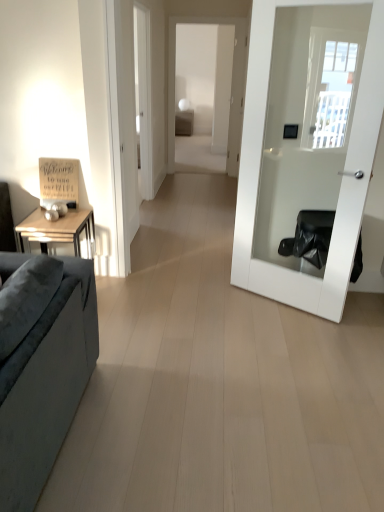
Question: Is white glossy door at right aimed at matte brown table at center?

Choices:
 (A) no
 (B) yes

Answer: (A)

Question: Is white glossy door at right not within matte brown table at center?

Choices:
 (A) no
 (B) yes

Answer: (B)

Question: From a real-world perspective, does white glossy door at right stand above matte brown table at center?

Choices:
 (A) no
 (B) yes

Answer: (B)

Question: Does white glossy door at right come in front of matte brown table at center?

Choices:
 (A) yes
 (B) no

Answer: (A)

Question: Is white glossy door at right facing away from matte brown table at center?

Choices:
 (A) yes
 (B) no

Answer: (B)

Question: Relative to matte brown table at center, is suede-like gray couch at left in front or behind?

Choices:
 (A) behind
 (B) front

Answer: (B)

Question: Is suede-like gray couch at left taller or shorter than matte brown table at center?

Choices:
 (A) short
 (B) tall

Answer: (A)

Question: From the image's perspective, is suede-like gray couch at left located above or below matte brown table at center?

Choices:
 (A) below
 (B) above

Answer: (A)

Question: Which is correct: suede-like gray couch at left is inside matte brown table at center, or outside of it?

Choices:
 (A) outside
 (B) inside

Answer: (A)

Question: Considering the positions of point (259, 108) and point (180, 123), is point (259, 108) closer or farther from the camera than point (180, 123)?

Choices:
 (A) closer
 (B) farther

Answer: (A)

Question: Is white glossy door at right spatially inside matte brown table at center, or outside of it?

Choices:
 (A) outside
 (B) inside

Answer: (A)

Question: Considering their positions, is white glossy door at right located in front of or behind matte brown table at center?

Choices:
 (A) front
 (B) behind

Answer: (A)

Question: Based on their sizes in the image, would you say white glossy door at right is bigger or smaller than matte brown table at center?

Choices:
 (A) big
 (B) small

Answer: (B)

Question: Is matte brown table at center bigger or smaller than white glossy door at right?

Choices:
 (A) big
 (B) small

Answer: (A)

Question: From the image's perspective, is matte brown table at center located above or below white glossy door at right?

Choices:
 (A) above
 (B) below

Answer: (A)